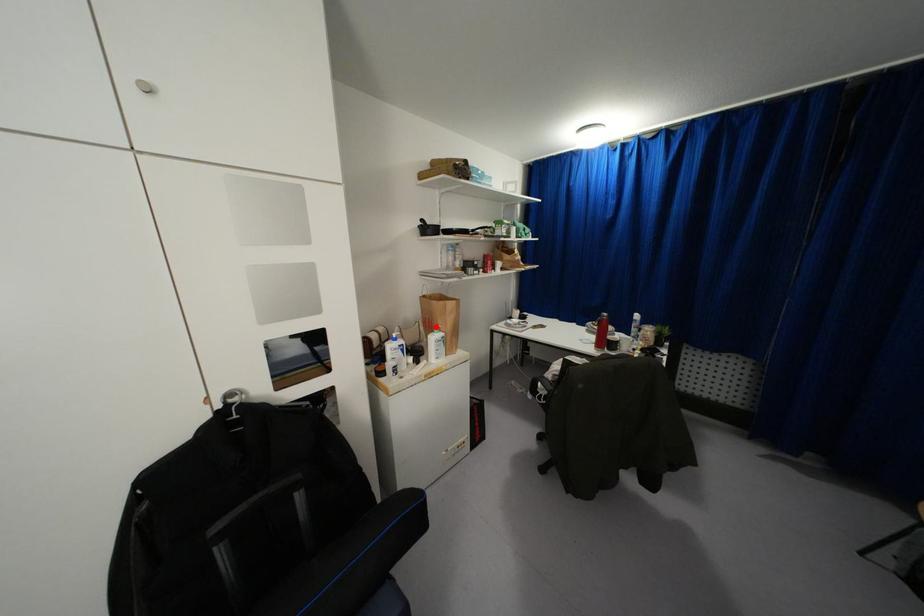
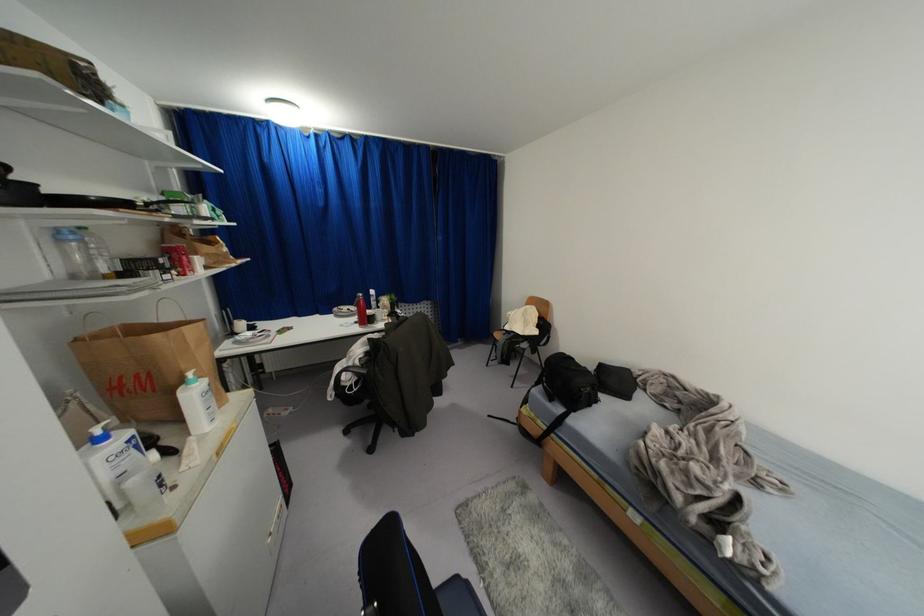
The point at the highlighted location is marked in the first image. Where is the corresponding point in the second image?

(189, 374)